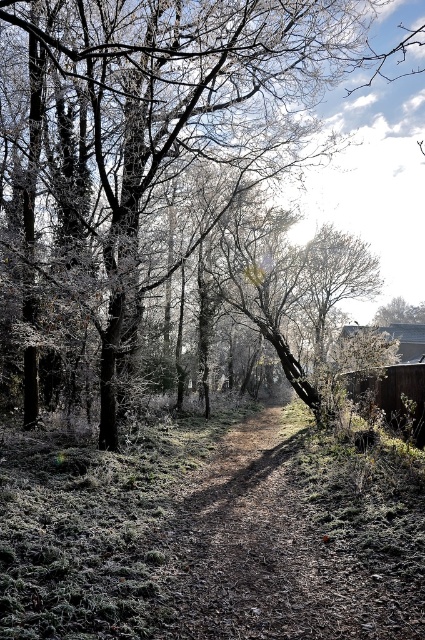
Between glossy bark tree at center and brown dirt track at center, which one has less height?

Standing shorter between the two is brown dirt track at center.

Can you confirm if glossy bark tree at center is positioned to the left of brown dirt track at center?

No, glossy bark tree at center is not to the left of brown dirt track at center.

Who is more forward, (238, 17) or (342, 589)?

Point (342, 589) is more forward.

This screenshot has height=640, width=425. In order to click on glossy bark tree at center in this screenshot , I will do `click(175, 115)`.